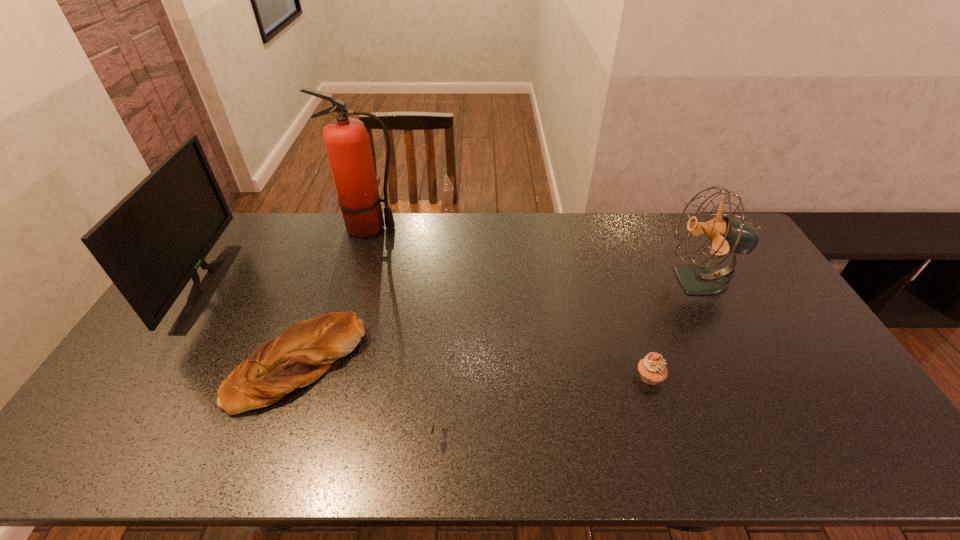
This screenshot has height=540, width=960. I want to click on object positioned at the right edge, so coord(727,234).

This screenshot has height=540, width=960. Identify the location of object positioned at the far left corner. (151, 244).

In the image, there is a desktop. What are the coordinates of `vacant region at the far edge` in the screenshot? It's located at (494, 246).

Identify the location of vacant region at the right edge of the desktop. This screenshot has width=960, height=540. tap(730, 263).

You are a GUI agent. You are given a task and a screenshot of the screen. Output one action in this format:
    pyautogui.click(x=<x>, y=<y>)
    Task: Click on the free spot at the far left corner of the desktop
    The image size is (960, 540).
    Given the screenshot: What is the action you would take?
    pyautogui.click(x=252, y=227)

What are the coordinates of `vacant space at the near right corner of the desktop` in the screenshot? It's located at (838, 437).

You are a GUI agent. You are given a task and a screenshot of the screen. Output one action in this format:
    pyautogui.click(x=<x>, y=<y>)
    Task: Click on the free spot between the rightmost object and the fifth shortest object
    The width and height of the screenshot is (960, 540).
    Given the screenshot: What is the action you would take?
    pyautogui.click(x=454, y=284)

Image resolution: width=960 pixels, height=540 pixels. What are the coordinates of `vacant space in between the fourth shortest object and the bread` in the screenshot? It's located at (499, 322).

This screenshot has height=540, width=960. I want to click on free spot between the bread and the fifth shortest object, so click(x=253, y=325).

The height and width of the screenshot is (540, 960). I want to click on unoccupied area between the fourth shortest object and the bread, so click(499, 322).